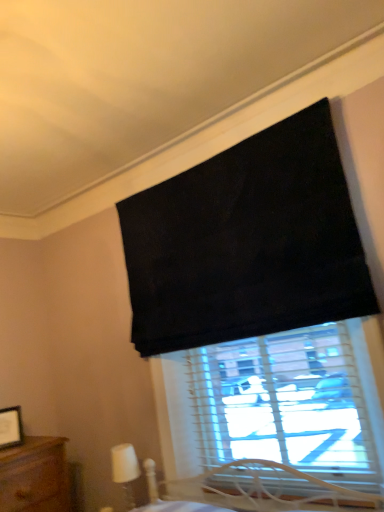
The image size is (384, 512). What do you see at coordinates (11, 426) in the screenshot? I see `wooden picture frame at lower left` at bounding box center [11, 426].

Locate an element on the screen. wooden picture frame at lower left is located at coordinates click(11, 426).

Find the location of `white plastic table lamp at lower left`. white plastic table lamp at lower left is located at coordinates (125, 471).

Describe the element at coordinates (125, 471) in the screenshot. Image resolution: width=384 pixels, height=512 pixels. I see `white plastic table lamp at lower left` at that location.

Measure the distance between point (128, 482) and camera.

Point (128, 482) and camera are 7.87 feet apart.

You are a GUI agent. You are given a task and a screenshot of the screen. Output one action in this format:
    pyautogui.click(x=<x>, y=<y>)
    Task: Click on the wooden picture frame at lower left
    This screenshot has height=512, width=384.
    Given the screenshot: What is the action you would take?
    pyautogui.click(x=11, y=426)

Is wooden picture frame at lower left at the right side of white plastic table lamp at lower left?

In fact, wooden picture frame at lower left is to the left of white plastic table lamp at lower left.

Is the depth of wooden picture frame at lower left less than that of white plastic table lamp at lower left?

No.

Is point (15, 414) behind point (113, 449)?

No.

From the image's perspective, is wooden picture frame at lower left beneath white plastic table lamp at lower left?

Actually, wooden picture frame at lower left appears above white plastic table lamp at lower left in the image.

From a real-world perspective, which object stands above the other?

wooden picture frame at lower left, from a real-world perspective.

Can you confirm if wooden picture frame at lower left is wider than white plastic table lamp at lower left?

In fact, wooden picture frame at lower left might be narrower than white plastic table lamp at lower left.

From their relative heights in the image, would you say wooden picture frame at lower left is taller or shorter than white plastic table lamp at lower left?

Clearly, wooden picture frame at lower left is shorter compared to white plastic table lamp at lower left.

Between wooden picture frame at lower left and white plastic table lamp at lower left, which one has smaller size?

wooden picture frame at lower left is smaller.

Is wooden picture frame at lower left spatially inside white plastic table lamp at lower left, or outside of it?

wooden picture frame at lower left is spatially situated outside white plastic table lamp at lower left.

Is wooden picture frame at lower left with white plastic table lamp at lower left?

No, wooden picture frame at lower left is not next to white plastic table lamp at lower left.

Is wooden picture frame at lower left turned away from white plastic table lamp at lower left?

No, white plastic table lamp at lower left is not at the back of wooden picture frame at lower left.

How far apart are wooden picture frame at lower left and white plastic table lamp at lower left?

They are 24.71 inches apart.

Where is `table lamp on the right of wooden picture frame at lower left`? table lamp on the right of wooden picture frame at lower left is located at coordinates [125, 471].

Can you confirm if white plastic table lamp at lower left is positioned to the left of wooden picture frame at lower left?

No, white plastic table lamp at lower left is not to the left of wooden picture frame at lower left.

Is white plastic table lamp at lower left behind wooden picture frame at lower left?

No, the depth of white plastic table lamp at lower left is less than that of wooden picture frame at lower left.

Considering the positions of point (126, 469) and point (19, 444), is point (126, 469) closer or farther from the camera than point (19, 444)?

Clearly, point (126, 469) is closer to the camera than point (19, 444).

From the image's perspective, is white plastic table lamp at lower left below wooden picture frame at lower left?

Correct, white plastic table lamp at lower left appears lower than wooden picture frame at lower left in the image.

From a real-world perspective, who is located lower, white plastic table lamp at lower left or wooden picture frame at lower left?

white plastic table lamp at lower left.

Considering the sizes of objects white plastic table lamp at lower left and wooden picture frame at lower left in the image provided, who is thinner, white plastic table lamp at lower left or wooden picture frame at lower left?

With smaller width is wooden picture frame at lower left.

From their relative heights in the image, would you say white plastic table lamp at lower left is taller or shorter than wooden picture frame at lower left?

white plastic table lamp at lower left is taller than wooden picture frame at lower left.

Which of these two, white plastic table lamp at lower left or wooden picture frame at lower left, is smaller?

Smaller between the two is wooden picture frame at lower left.

Which is correct: white plastic table lamp at lower left is inside wooden picture frame at lower left, or outside of it?

white plastic table lamp at lower left exists outside the volume of wooden picture frame at lower left.

Consider the image. Would you consider white plastic table lamp at lower left to be distant from wooden picture frame at lower left?

No, white plastic table lamp at lower left is in close proximity to wooden picture frame at lower left.

Is white plastic table lamp at lower left positioned with its back to wooden picture frame at lower left?

That's not correct — white plastic table lamp at lower left is not looking away from wooden picture frame at lower left.

Locate an element on the screen. The height and width of the screenshot is (512, 384). picture frame lying on the left of white plastic table lamp at lower left is located at coordinates (11, 426).

Locate an element on the screen. picture frame above the white plastic table lamp at lower left (from the image's perspective) is located at coordinates (11, 426).

Where is `table lamp that appears in front of the wooden picture frame at lower left`? The width and height of the screenshot is (384, 512). table lamp that appears in front of the wooden picture frame at lower left is located at coordinates (125, 471).